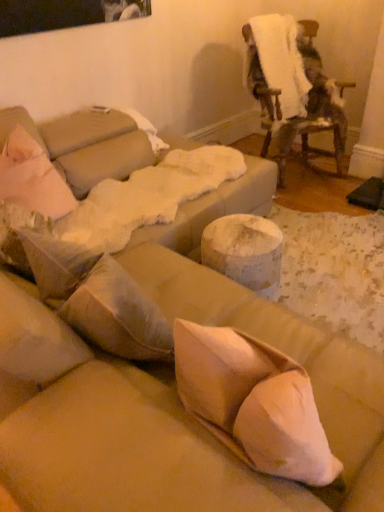
Question: From a real-world perspective, is white fluffy blanket at upper right above or below fuzzy white blanket at upper right?

Choices:
 (A) below
 (B) above

Answer: (B)

Question: In terms of height, does white fluffy blanket at upper right look taller or shorter compared to fuzzy white blanket at upper right?

Choices:
 (A) short
 (B) tall

Answer: (A)

Question: Considering their positions, is white fluffy blanket at upper right located in front of or behind fuzzy white blanket at upper right?

Choices:
 (A) behind
 (B) front

Answer: (A)

Question: Is point (324, 75) closer or farther from the camera than point (274, 57)?

Choices:
 (A) closer
 (B) farther

Answer: (B)

Question: In the image, is fuzzy white blanket at upper right on the left side or the right side of white fluffy blanket at upper right?

Choices:
 (A) right
 (B) left

Answer: (A)

Question: In the image, is fuzzy white blanket at upper right positioned in front of or behind white fluffy blanket at upper right?

Choices:
 (A) behind
 (B) front

Answer: (B)

Question: Is fuzzy white blanket at upper right bigger or smaller than white fluffy blanket at upper right?

Choices:
 (A) big
 (B) small

Answer: (A)